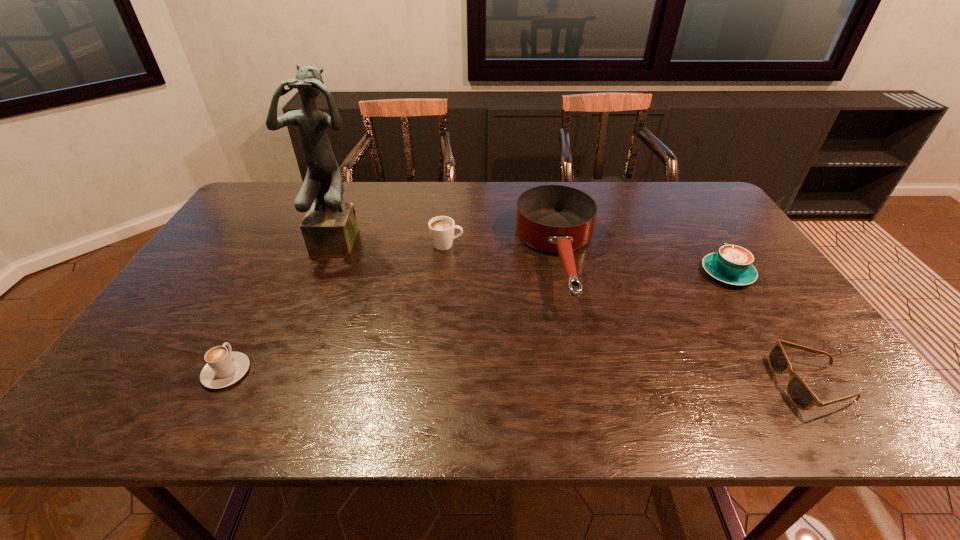
In the image, there is a desktop. Where is `vacant space at the near left corner`? vacant space at the near left corner is located at coordinates (142, 413).

Where is `free space between the sunglasses and the rightmost cappuccino`? free space between the sunglasses and the rightmost cappuccino is located at coordinates (769, 328).

What are the coordinates of `vacant space that's between the pan and the farthest cappuccino` in the screenshot? It's located at point(503,251).

This screenshot has height=540, width=960. In order to click on vacant area that lies between the sunglasses and the second cappuccino from left to right in this screenshot , I will do `click(629, 314)`.

Identify the location of vacant area that lies between the second nearest cappuccino and the leftmost cappuccino. (477, 322).

In order to click on vacant space in between the fourth object from left to right and the sunglasses in this screenshot , I will do `click(685, 321)`.

The height and width of the screenshot is (540, 960). What are the coordinates of `empty location between the leftmost cappuccino and the second nearest cappuccino` in the screenshot? It's located at (477, 322).

Identify the location of free space between the fourth object from left to right and the fourth object from right to left. The width and height of the screenshot is (960, 540). point(503,251).

This screenshot has height=540, width=960. I want to click on empty space that is in between the second nearest cappuccino and the sunglasses, so click(769, 328).

Where is `object that is the fourth closest to the sunglasses`? The height and width of the screenshot is (540, 960). object that is the fourth closest to the sunglasses is located at coordinates (330, 226).